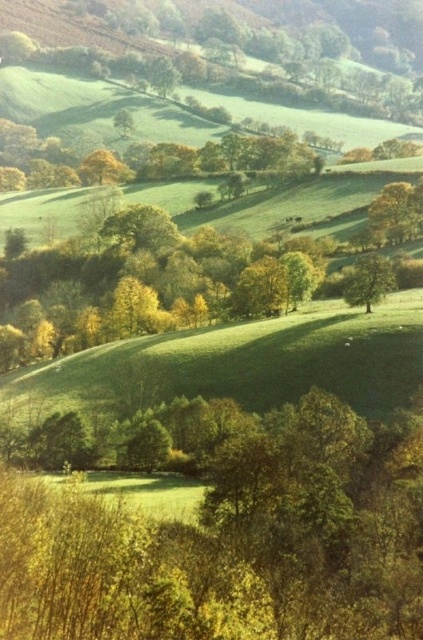
Is green leafy tree at upper right wider than green leafy tree at center-right?

Correct, the width of green leafy tree at upper right exceeds that of green leafy tree at center-right.

Can you confirm if green leafy tree at upper right is positioned to the left of green leafy tree at center-right?

No, green leafy tree at upper right is not to the left of green leafy tree at center-right.

Image resolution: width=423 pixels, height=640 pixels. In order to click on green leafy tree at upper right in this screenshot , I will do `click(397, 212)`.

Does green leafy tree at lower left appear over green leafy tree at center?

Incorrect, green leafy tree at lower left is not positioned above green leafy tree at center.

Who is more forward, (241, 493) or (112, 227)?

Positioned in front is point (241, 493).

Which is behind, point (242, 637) or point (14, 241)?

The point (14, 241) is more distant.

Where is `green leafy tree at lower left`? Image resolution: width=423 pixels, height=640 pixels. green leafy tree at lower left is located at coordinates (233, 540).

Between green leafy tree at lower left and green leafy tree at center-right, which one appears on the right side from the viewer's perspective?

green leafy tree at center-right

Is point (24, 602) more distant than point (392, 280)?

No, it is in front of (392, 280).

This screenshot has width=423, height=640. I want to click on green leafy tree at lower left, so click(x=233, y=540).